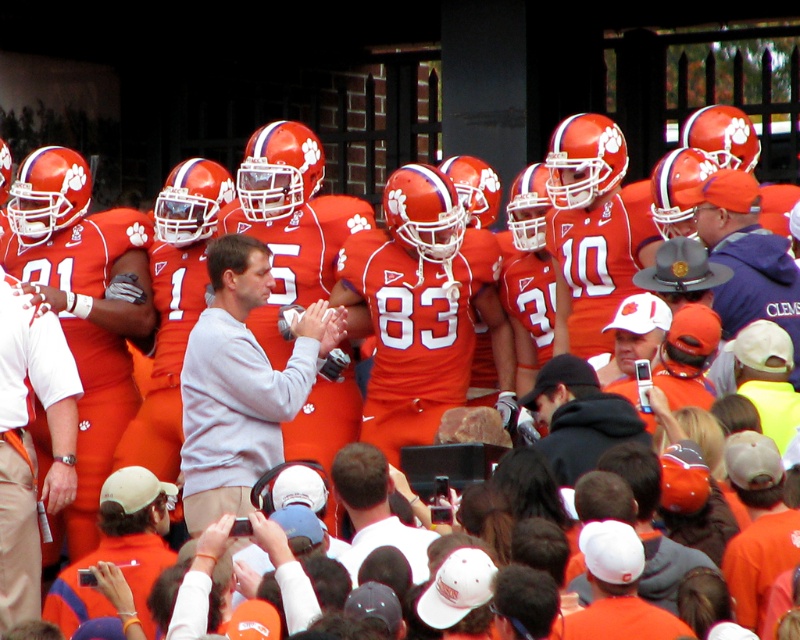
Question: Which object appears closest to the camera in this image?

Choices:
 (A) white matte cap at center
 (B) black hoodie at center
 (C) orange jersey at lower left
 (D) gray sweatshirt at center

Answer: (C)

Question: Which object is the farthest from the black hoodie at center?

Choices:
 (A) white matte cap at center
 (B) orange jersey at lower left
 (C) gray sweatshirt at center

Answer: (B)

Question: In this image, where is gray sweatshirt at center located relative to black hoodie at center?

Choices:
 (A) above
 (B) below

Answer: (A)

Question: Which point appears farthest from the camera in this image?

Choices:
 (A) (546, 364)
 (B) (262, 262)
 (C) (120, 486)

Answer: (B)

Question: Can you confirm if orange jersey at lower left is bigger than white matte cap at center?

Choices:
 (A) yes
 (B) no

Answer: (B)

Question: Can you confirm if gray sweatshirt at center is positioned above black hoodie at center?

Choices:
 (A) yes
 (B) no

Answer: (A)